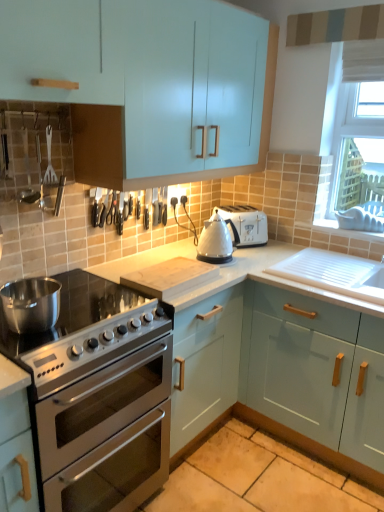
At what (x,y) coordinates should I click in order to perform the action: click on blank space situated above matte light blue cabinet at center, the second cabinetry ordered from the bottom (from a real-world perspective). Please return your answer as a coordinate pair (x, y). The image size is (384, 512). Looking at the image, I should click on (276, 266).